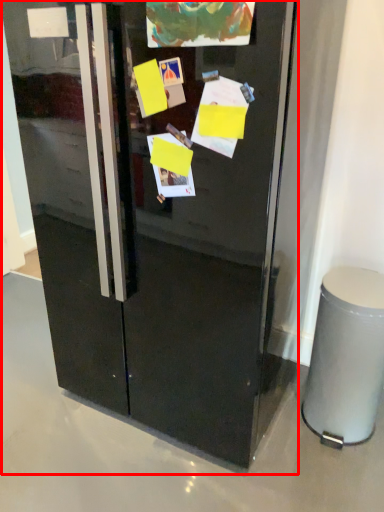
Question: From the image's perspective, what is the correct spatial positioning of refrigerator (annotated by the red box) in reference to trash bin/can?

Choices:
 (A) below
 (B) above

Answer: (B)